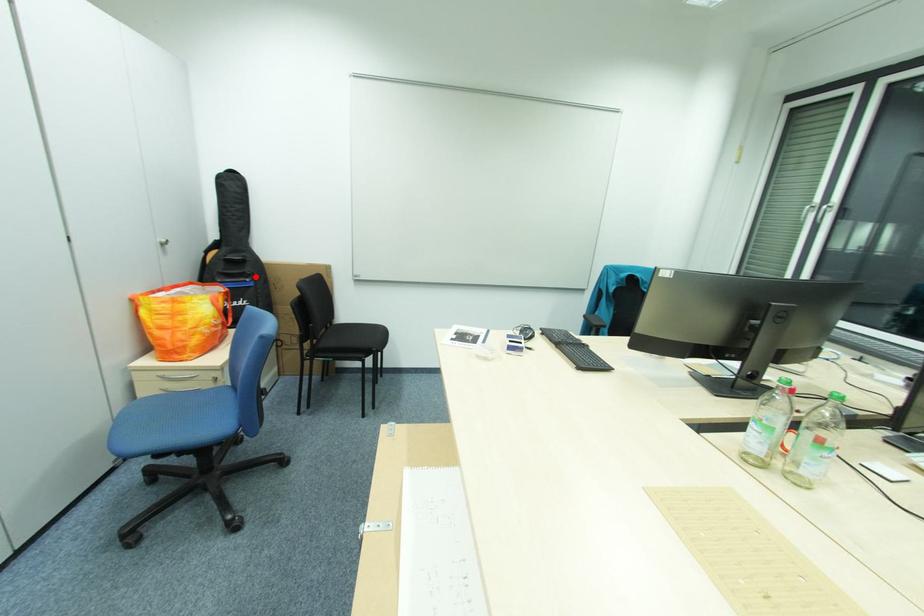
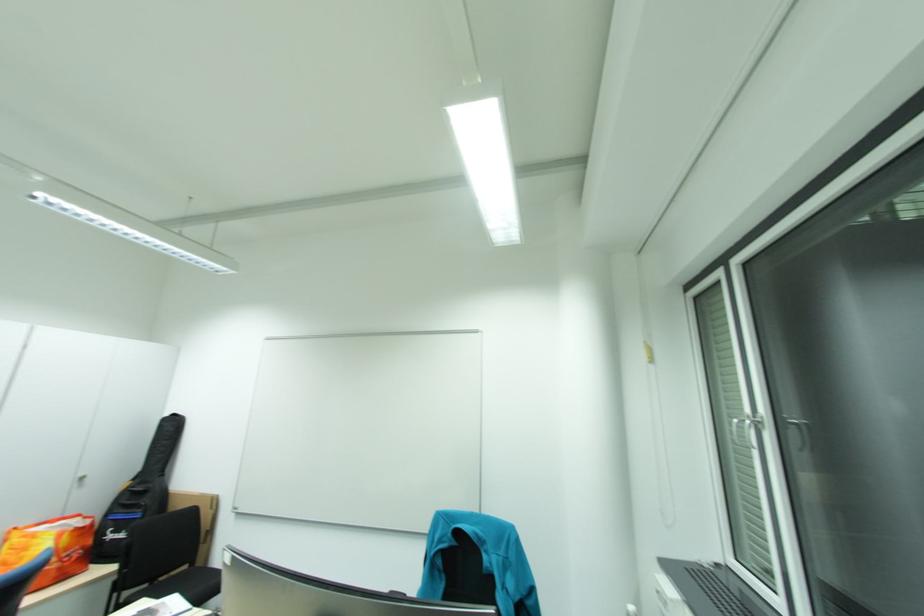
The point at the highlighted location is marked in the first image. Where is the corresponding point in the second image?

(149, 508)